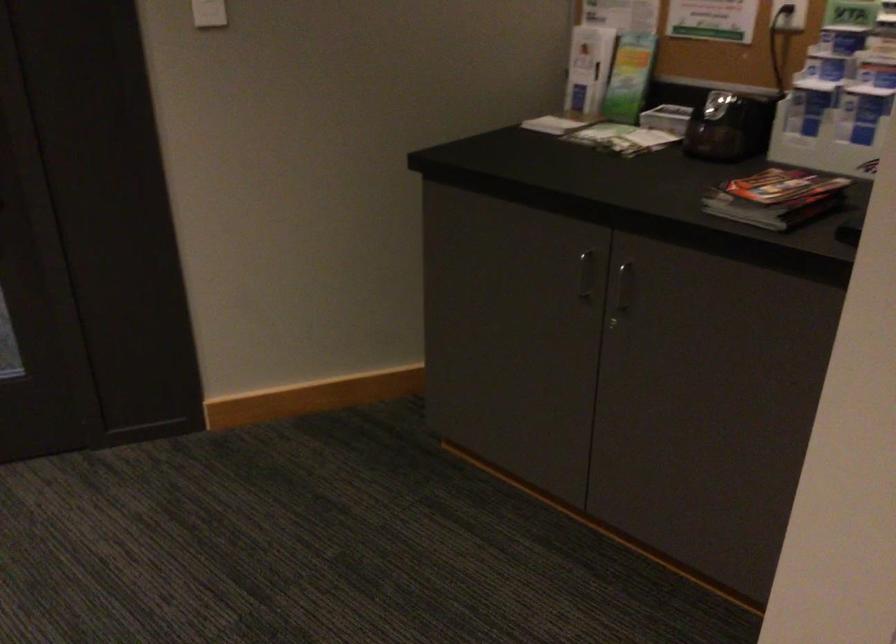
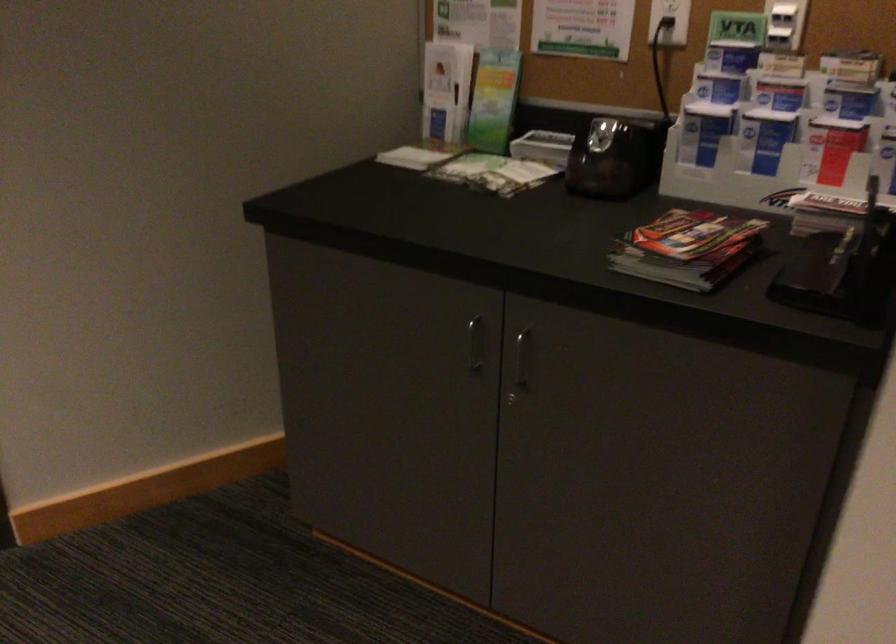
The point at (769, 198) is marked in the first image. Where is the corresponding point in the second image?

(687, 249)